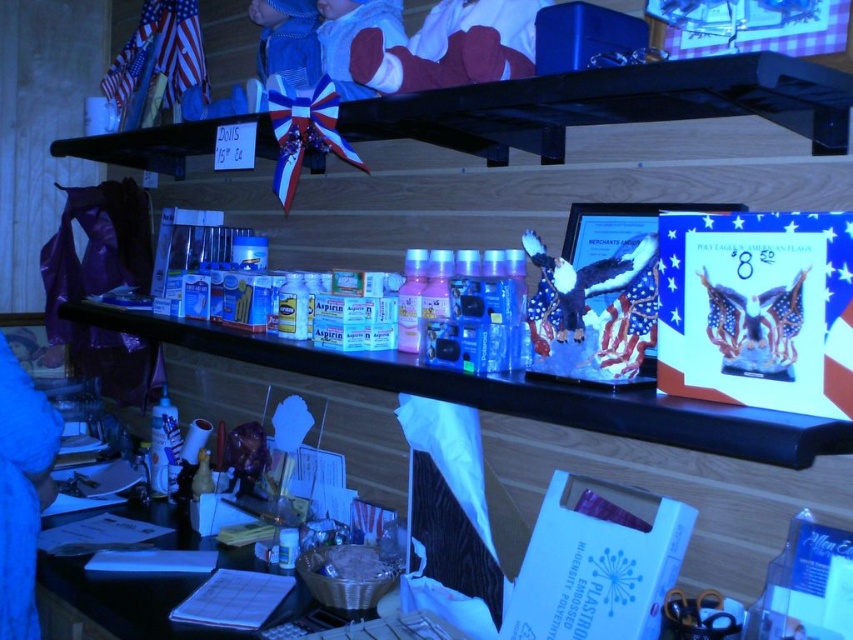
Question: Can you confirm if soft cotton baby at upper center is bigger than fuzzy fabric eagle at center?

Choices:
 (A) no
 (B) yes

Answer: (B)

Question: Which point is farther from the camera taking this photo?

Choices:
 (A) (498, 32)
 (B) (635, 364)

Answer: (A)

Question: Is soft cotton baby at upper center bigger than fuzzy fabric eagle at center?

Choices:
 (A) yes
 (B) no

Answer: (A)

Question: Which point is farther to the camera?

Choices:
 (A) (579, 321)
 (B) (395, 65)

Answer: (B)

Question: Which point is closer to the camera?

Choices:
 (A) soft cotton baby at upper center
 (B) fuzzy fabric eagle at center

Answer: (B)

Question: Does soft cotton baby at upper center appear on the right side of fuzzy fabric eagle at center?

Choices:
 (A) no
 (B) yes

Answer: (A)